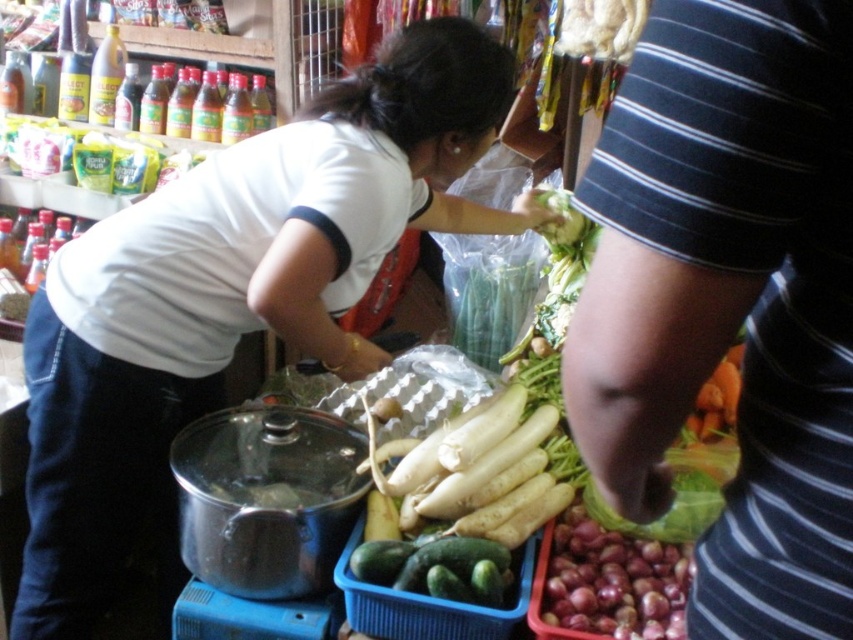
Question: Can you confirm if white matte radish at center is positioned below smooth purple onion at lower right?

Choices:
 (A) yes
 (B) no

Answer: (B)

Question: Considering the real-world distances, which object is closest to the smooth purple onion at lower right?

Choices:
 (A) white matte radish at center
 (B) striped fabric arm at right
 (C) green matte cucumber at center

Answer: (C)

Question: Which point is farther from the camera taking this photo?

Choices:
 (A) (735, 241)
 (B) (608, 609)
 (C) (547, 349)

Answer: (C)

Question: Does white matte radish at center have a greater width compared to green matte cucumber at center?

Choices:
 (A) no
 (B) yes

Answer: (B)

Question: Which of these objects is positioned closest to the green matte cucumber at center?

Choices:
 (A) white matte radish at center
 (B) striped fabric arm at right

Answer: (A)

Question: Is striped fabric arm at right behind smooth purple onion at lower right?

Choices:
 (A) no
 (B) yes

Answer: (A)